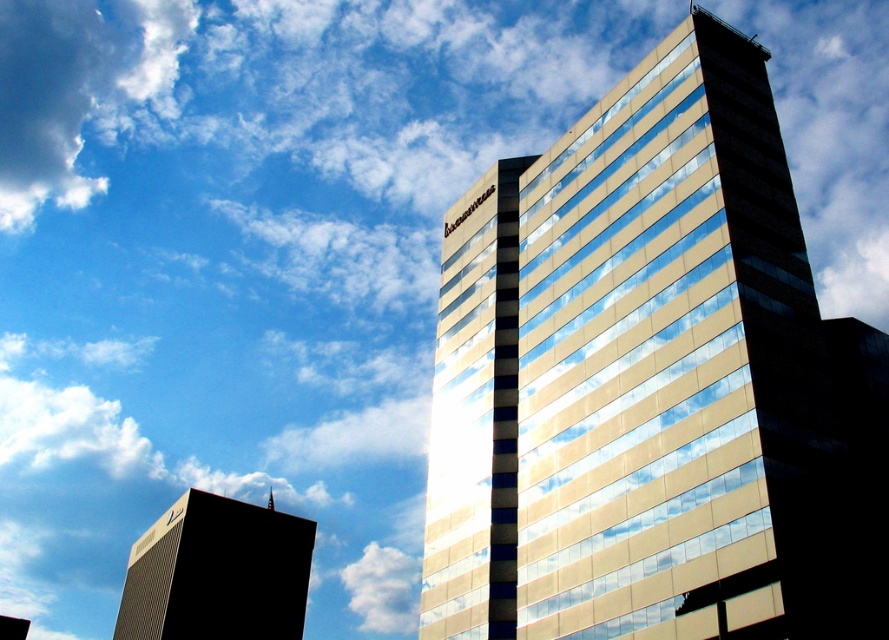
Question: In this image, where is gold reflective glass building at center located relative to black glass tower at lower left?

Choices:
 (A) above
 (B) below

Answer: (A)

Question: Which point is farther from the camera taking this photo?

Choices:
 (A) (63, 20)
 (B) (453, 483)
 (C) (209, 509)
 (D) (377, 554)

Answer: (A)

Question: Which object is the closest to the white fluffy cloud at upper left?

Choices:
 (A) white fluffy cloud at upper center
 (B) gold reflective glass building at center
 (C) black glass tower at lower left

Answer: (A)

Question: Observing the image, what is the correct spatial positioning of gold reflective glass building at center in reference to white fluffy cloud at upper left?

Choices:
 (A) left
 (B) right

Answer: (B)

Question: Which object is the closest to the white fluffy cloud at upper left?

Choices:
 (A) gold reflective glass building at center
 (B) black glass tower at lower left
 (C) white fluffy cloud at upper center

Answer: (C)

Question: Does black glass tower at lower left have a larger size compared to white fluffy cloud at upper center?

Choices:
 (A) yes
 (B) no

Answer: (A)